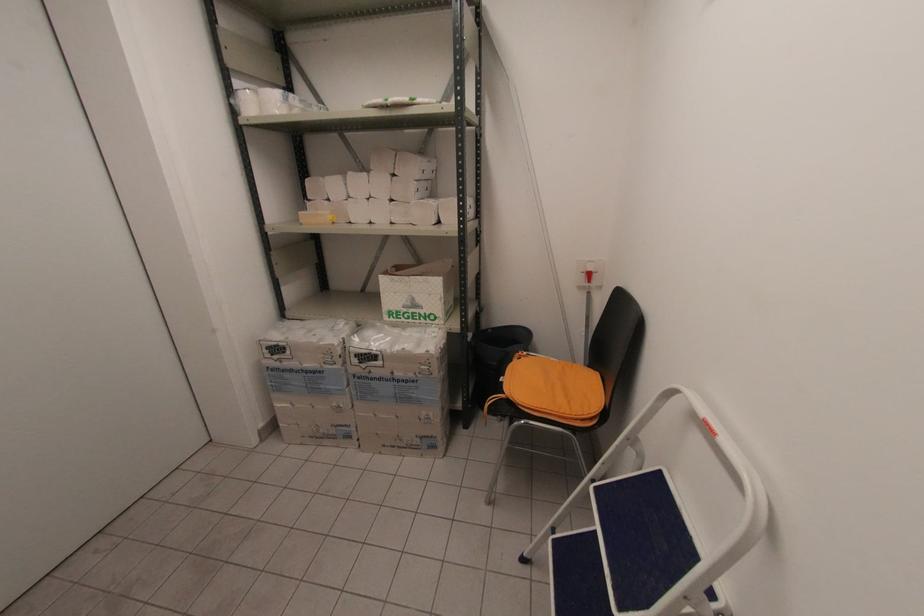
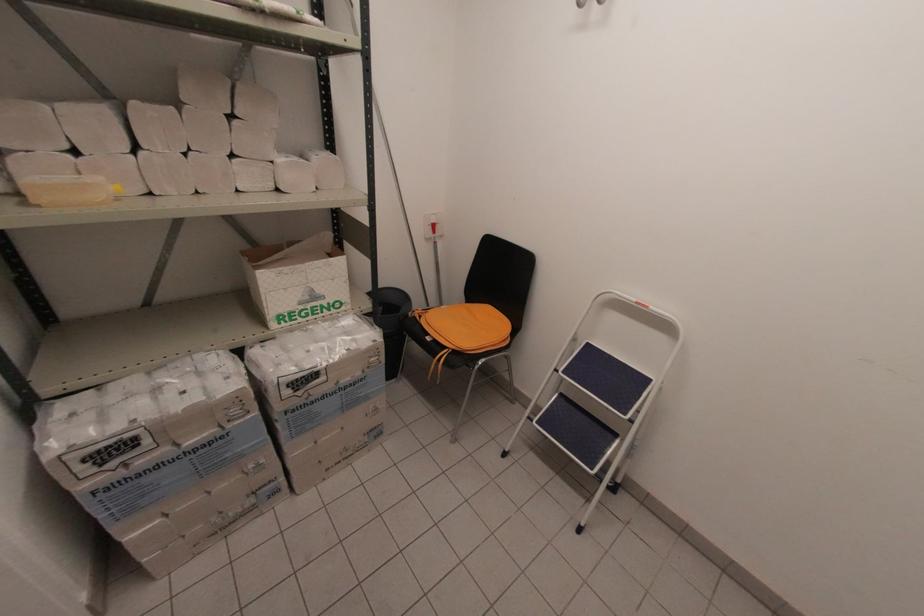
Locate, in the second image, the point that corresponds to (410,304) in the first image.

(309, 298)